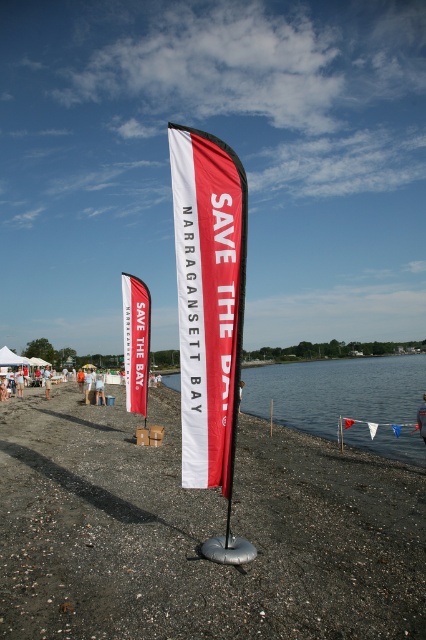
Question: Is red/white fabric flag at center bigger than transparent water at lower center?

Choices:
 (A) yes
 (B) no

Answer: (B)

Question: Which of the following is the closest to the observer?

Choices:
 (A) red/white fabric flag at center
 (B) transparent water at lower center
 (C) black gravel sand at center

Answer: (C)

Question: Which object is positioned closest to the transparent water at lower center?

Choices:
 (A) red/white fabric flag at center
 (B) black gravel sand at center
 (C) white fabric banner at center

Answer: (B)

Question: Can you confirm if black gravel sand at center is smaller than red/white fabric flag at center?

Choices:
 (A) no
 (B) yes

Answer: (A)

Question: Which object is farther from the camera taking this photo?

Choices:
 (A) black gravel sand at center
 (B) white fabric banner at center
 (C) red/white fabric flag at center
 (D) transparent water at lower center

Answer: (D)

Question: Can you confirm if red/white fabric flag at center is positioned below white fabric banner at center?

Choices:
 (A) no
 (B) yes

Answer: (A)